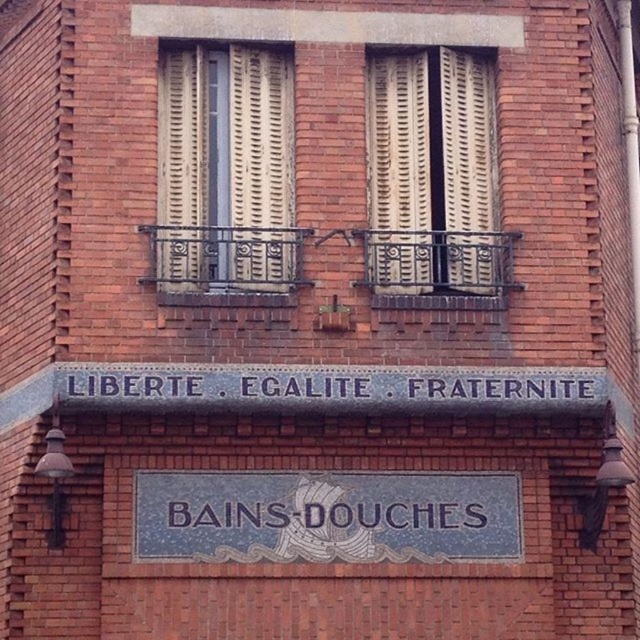
You are a painter standing in front of the brick building facade. You need to paint both the blue mosaic sign at center and the gray stone sign at center. Which sign should you paint first if you want to paint the one that is closer to you first?

You should paint the blue mosaic sign at center first because the gray stone sign at center is behind it, meaning the blue mosaic sign at center is closer to you.

You are a painter standing at the base of the building. You need to paint both the blue mosaic sign at center and the iron textured balcony at center. If your ladder can reach up to 4 meters, can you paint both without moving the ladder?

The blue mosaic sign at center and the iron textured balcony at center are 4.04 meters apart from each other. Since the ladder can only reach up to 4 meters, you cannot paint both without moving the ladder because the distance between them exceeds the ladder height limit.

You are a visitor looking at the building facade and see both the blue mosaic sign at center and the gray stone sign at center. Which sign is located to the right of the other?

The blue mosaic sign at center is positioned on the right side of gray stone sign at center.